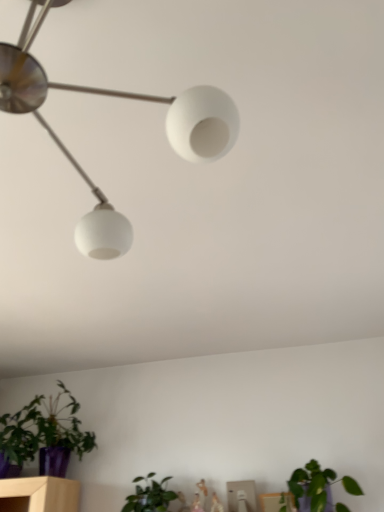
Question: Is matte purple pot at lower left, positioned as the first houseplant in left-to-right order, positioned far away from green matte plant at lower right, the first houseplant from the right?

Choices:
 (A) no
 (B) yes

Answer: (B)

Question: Does matte purple pot at lower left, positioned as the first houseplant in left-to-right order, have a greater width compared to green matte plant at lower right, which is counted as the second houseplant, starting from the left?

Choices:
 (A) no
 (B) yes

Answer: (B)

Question: Is matte purple pot at lower left, which is counted as the 2th houseplant, starting from the right, bigger than green matte plant at lower right, which is counted as the second houseplant, starting from the left?

Choices:
 (A) no
 (B) yes

Answer: (B)

Question: Is the depth of matte purple pot at lower left, positioned as the first houseplant in left-to-right order, greater than that of green matte plant at lower right, the first houseplant from the right?

Choices:
 (A) yes
 (B) no

Answer: (A)

Question: From the image's perspective, does matte purple pot at lower left, positioned as the first houseplant in left-to-right order, appear higher than green matte plant at lower right, the first houseplant from the right?

Choices:
 (A) no
 (B) yes

Answer: (B)

Question: Can you confirm if matte purple pot at lower left, which is counted as the 2th houseplant, starting from the right, is taller than green matte plant at lower right, the first houseplant from the right?

Choices:
 (A) no
 (B) yes

Answer: (B)

Question: Does green matte plant at lower right, which is counted as the second houseplant, starting from the left, have a lesser height compared to matte purple pot at lower left, positioned as the first houseplant in left-to-right order?

Choices:
 (A) yes
 (B) no

Answer: (A)

Question: Does green matte plant at lower right, the first houseplant from the right, appear on the right side of matte purple pot at lower left, positioned as the first houseplant in left-to-right order?

Choices:
 (A) no
 (B) yes

Answer: (B)

Question: Can you confirm if green matte plant at lower right, the first houseplant from the right, is bigger than matte purple pot at lower left, positioned as the first houseplant in left-to-right order?

Choices:
 (A) no
 (B) yes

Answer: (A)

Question: Does green matte plant at lower right, the first houseplant from the right, appear on the left side of matte purple pot at lower left, positioned as the first houseplant in left-to-right order?

Choices:
 (A) no
 (B) yes

Answer: (A)

Question: Is matte purple pot at lower left, positioned as the first houseplant in left-to-right order, located within green matte plant at lower right, which is counted as the second houseplant, starting from the left?

Choices:
 (A) yes
 (B) no

Answer: (B)

Question: Is green matte plant at lower right, which is counted as the second houseplant, starting from the left, turned away from matte purple pot at lower left, which is counted as the 2th houseplant, starting from the right?

Choices:
 (A) no
 (B) yes

Answer: (A)

Question: In terms of width, does matte purple pot at lower left, positioned as the first houseplant in left-to-right order, look wider or thinner when compared to green matte plant at lower right, which is counted as the second houseplant, starting from the left?

Choices:
 (A) thin
 (B) wide

Answer: (B)